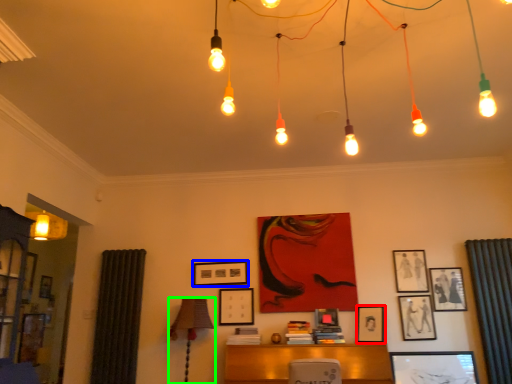
Question: Which is nearer to the picture frame (highlighted by a red box)? picture frame (highlighted by a blue box) or table lamp (highlighted by a green box).

Choices:
 (A) picture frame
 (B) table lamp

Answer: (A)